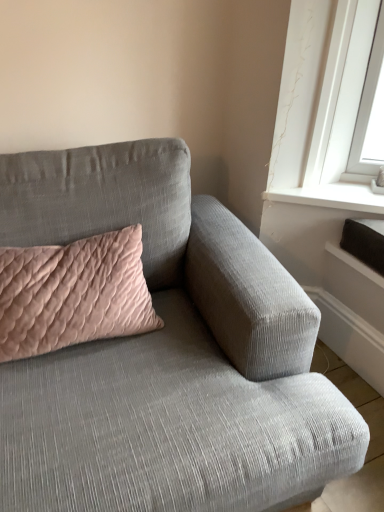
Question: Is the depth of pink quilted cushion at upper left greater than that of textured gray couch at center?

Choices:
 (A) yes
 (B) no

Answer: (A)

Question: Could you tell me if pink quilted cushion at upper left is facing textured gray couch at center?

Choices:
 (A) yes
 (B) no

Answer: (A)

Question: From a real-world perspective, is pink quilted cushion at upper left positioned under textured gray couch at center based on gravity?

Choices:
 (A) yes
 (B) no

Answer: (B)

Question: From the image's perspective, is pink quilted cushion at upper left on top of textured gray couch at center?

Choices:
 (A) yes
 (B) no

Answer: (A)

Question: From the image's perspective, is pink quilted cushion at upper left located beneath textured gray couch at center?

Choices:
 (A) no
 (B) yes

Answer: (A)

Question: Is pink quilted cushion at upper left at the right side of textured gray couch at center?

Choices:
 (A) no
 (B) yes

Answer: (A)

Question: Does textured gray couch at center have a lesser width compared to pink quilted cushion at upper left?

Choices:
 (A) yes
 (B) no

Answer: (B)

Question: Does textured gray couch at center have a larger size compared to pink quilted cushion at upper left?

Choices:
 (A) yes
 (B) no

Answer: (A)

Question: From a real-world perspective, is textured gray couch at center located higher than pink quilted cushion at upper left?

Choices:
 (A) no
 (B) yes

Answer: (A)

Question: Considering the relative positions of textured gray couch at center and pink quilted cushion at upper left in the image provided, is textured gray couch at center behind pink quilted cushion at upper left?

Choices:
 (A) no
 (B) yes

Answer: (A)

Question: Is textured gray couch at center facing towards pink quilted cushion at upper left?

Choices:
 (A) yes
 (B) no

Answer: (A)

Question: Is textured gray couch at center surrounding pink quilted cushion at upper left?

Choices:
 (A) yes
 (B) no

Answer: (A)

Question: From a real-world perspective, is textured gray couch at center above or below pink quilted cushion at upper left?

Choices:
 (A) above
 (B) below

Answer: (B)